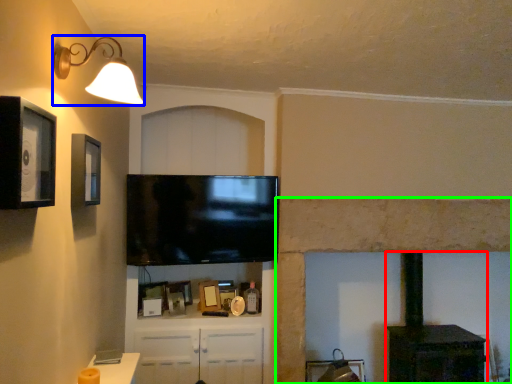
Question: Which is nearer to the stove (highlighted by a red box)? light fixture (highlighted by a blue box) or fireplace (highlighted by a green box).

Choices:
 (A) light fixture
 (B) fireplace

Answer: (B)